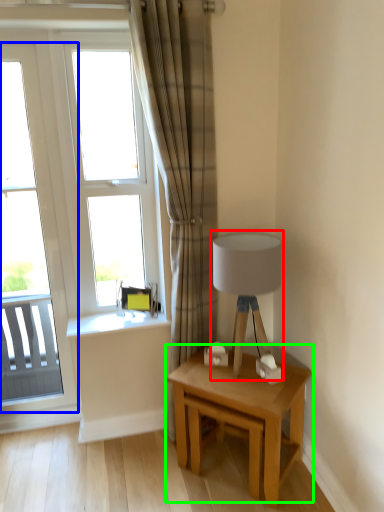
Question: Estimate the real-world distances between objects in this image. Which object is farther from table lamp (highlighted by a red box), window (highlighted by a blue box) or table (highlighted by a green box)?

Choices:
 (A) window
 (B) table

Answer: (A)